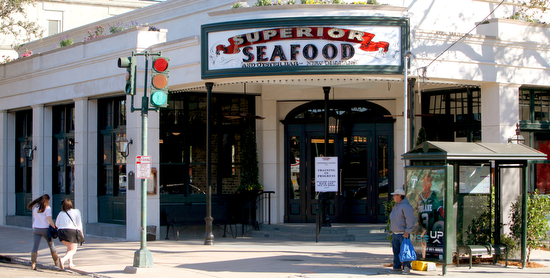
Image resolution: width=550 pixels, height=278 pixels. In order to click on door in this screenshot , I will do `click(361, 173)`, `click(322, 143)`.